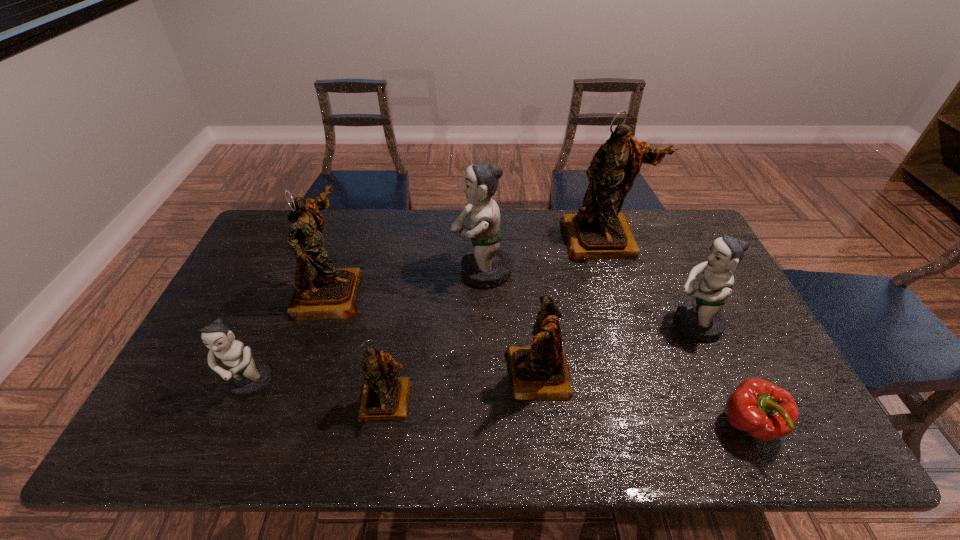
You are a GUI agent. You are given a task and a screenshot of the screen. Output one action in this format:
    pyautogui.click(x=<x>, y=<y>)
    Task: Click on the object present at the left edge
    This screenshot has width=960, height=540.
    Given the screenshot: What is the action you would take?
    pyautogui.click(x=246, y=377)

Locate an element on the screen. Image resolution: width=960 pixels, height=540 pixels. figurine located at the right edge is located at coordinates (701, 319).

This screenshot has height=540, width=960. Identify the location of pepper at the right edge. (767, 412).

Identify the location of object at the near right corner. Image resolution: width=960 pixels, height=540 pixels. (767, 412).

Identify the location of blank space at the far edge of the desktop. (516, 241).

Image resolution: width=960 pixels, height=540 pixels. Identify the location of vacant position at the near edge of the desktop. (215, 444).

The height and width of the screenshot is (540, 960). What are the coordinates of `vacant space at the left edge` in the screenshot? It's located at (224, 303).

Where is `free space at the far right corner`? This screenshot has height=540, width=960. free space at the far right corner is located at coordinates (697, 248).

I want to click on vacant area that lies between the third biggest gold figurine and the shortest object, so click(x=644, y=401).

The image size is (960, 540). Identify the location of unoccupied area between the pink pepper and the tallest object. (676, 333).